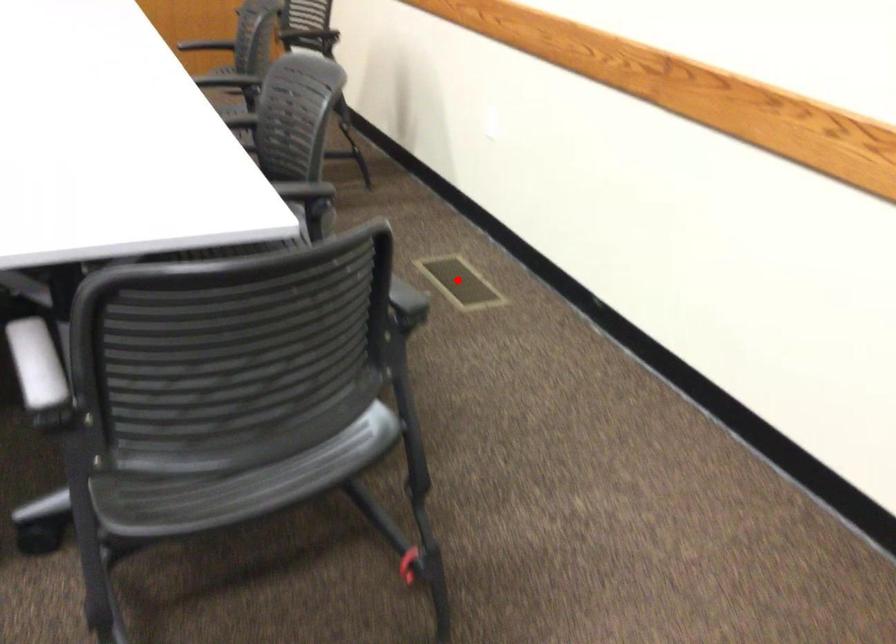
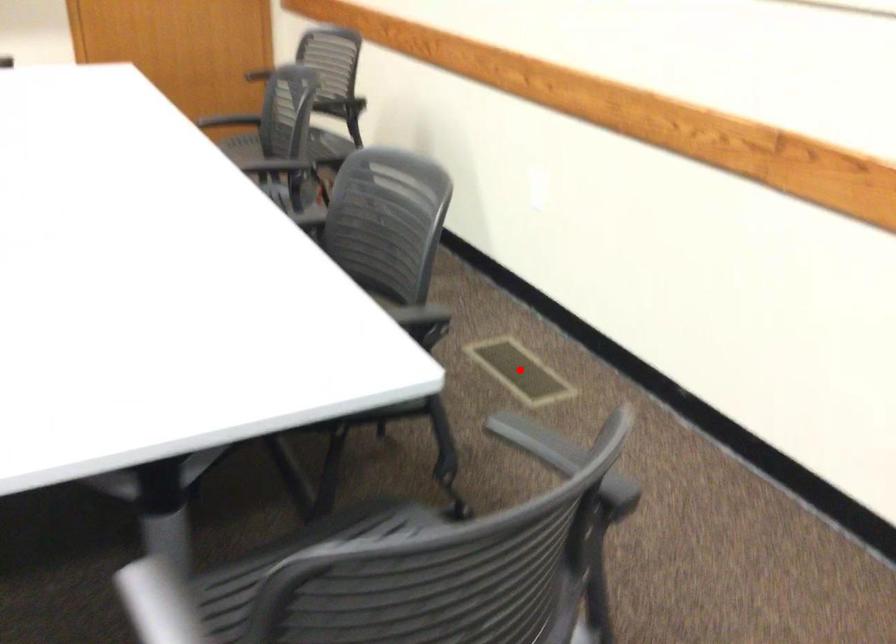
I am providing you with two images of the same scene from different viewpoints. A red point is marked on the first image and another point is marked on the second image. Does the point marked in image1 correspond to the same location as the one in image2?

Yes